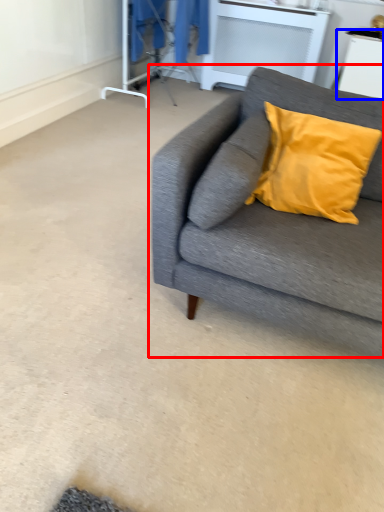
Question: Which object is closer to the camera taking this photo, studio couch (highlighted by a red box) or table (highlighted by a blue box)?

Choices:
 (A) studio couch
 (B) table

Answer: (A)